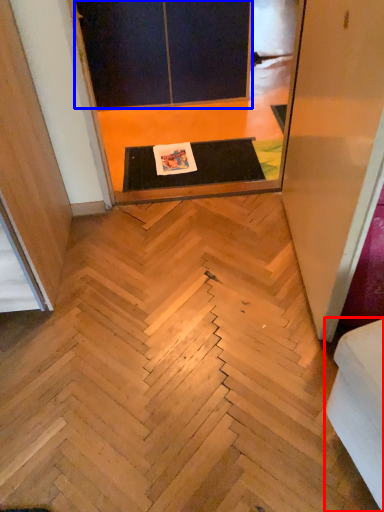
Question: Among these objects, which one is farthest to the camera, furniture (highlighted by a red box) or screen door (highlighted by a blue box)?

Choices:
 (A) furniture
 (B) screen door

Answer: (B)